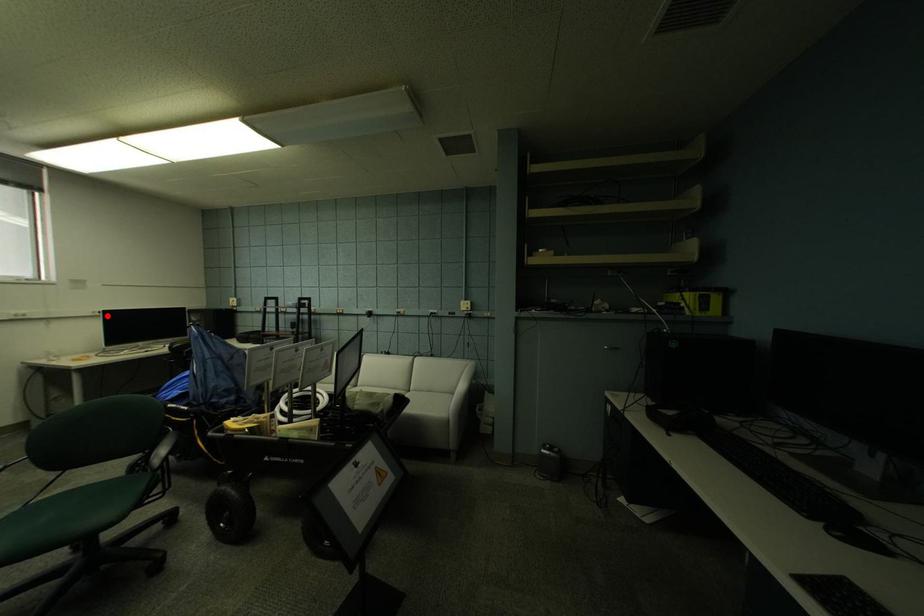
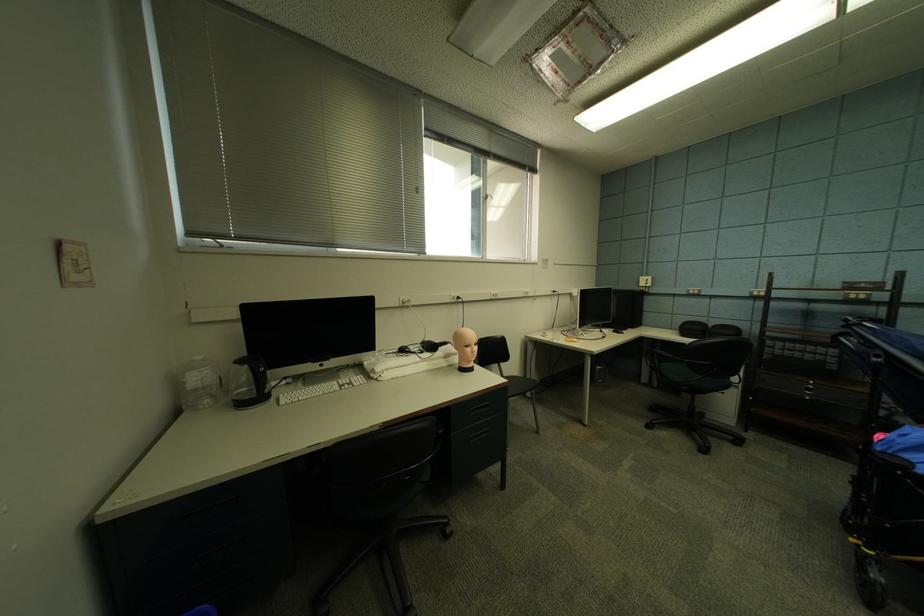
In the second image, find the point that corresponds to the highlighted location in the first image.

(561, 294)